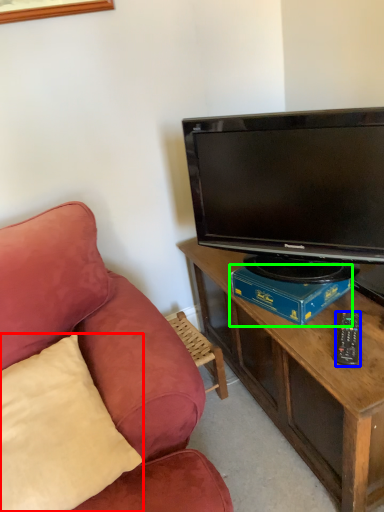
Question: Which is farther away from pillow (highlighted by a red box)? remote control (highlighted by a blue box) or book (highlighted by a green box)?

Choices:
 (A) remote control
 (B) book

Answer: (A)